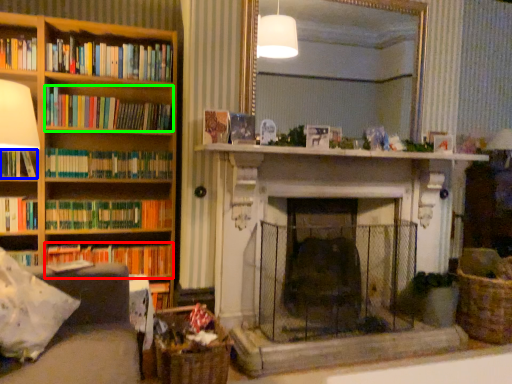
Question: Which is farther away from book (highlighted by a red box)? book (highlighted by a blue box) or book (highlighted by a green box)?

Choices:
 (A) book
 (B) book

Answer: (B)